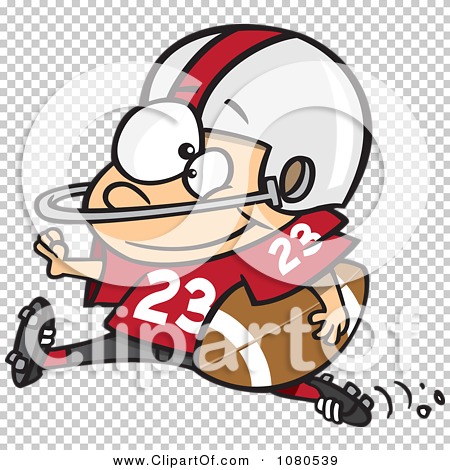
This screenshot has height=470, width=450. I want to click on artwork, so click(265, 292).